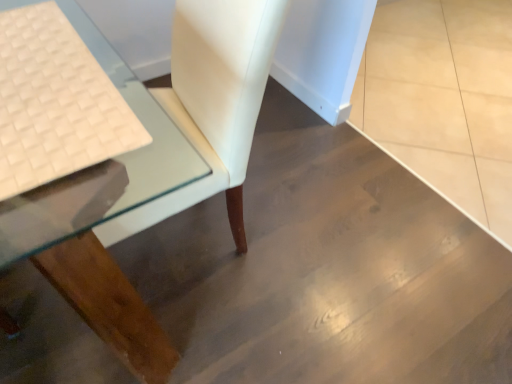
What is the approximate width of white woven fabric at left?

white woven fabric at left is 13.31 inches in width.

This screenshot has width=512, height=384. What do you see at coordinates (55, 102) in the screenshot? I see `white woven fabric at left` at bounding box center [55, 102].

Locate an element on the screen. white woven fabric at left is located at coordinates (55, 102).

Measure the distance between clear glass table at lower left and camera.

They are 21.34 inches apart.

The width and height of the screenshot is (512, 384). Describe the element at coordinates (102, 216) in the screenshot. I see `clear glass table at lower left` at that location.

Locate an element on the screen. The image size is (512, 384). clear glass table at lower left is located at coordinates (102, 216).

This screenshot has width=512, height=384. What are the coordinates of `white woven fabric at left` in the screenshot? It's located at (55, 102).

Is clear glass table at lower left to the right of white woven fabric at left from the viewer's perspective?

Yes, clear glass table at lower left is to the right of white woven fabric at left.

Is clear glass table at lower left behind white woven fabric at left?

That is False.

Looking at this image, which is closer, (152, 137) or (20, 14)?

Point (152, 137) is farther from the camera than point (20, 14).

From the image's perspective, which one is positioned lower, clear glass table at lower left or white woven fabric at left?

white woven fabric at left.

From a real-world perspective, is clear glass table at lower left beneath white woven fabric at left?

A: Indeed, from a real-world perspective, clear glass table at lower left is positioned beneath white woven fabric at left.

Does clear glass table at lower left have a greater width compared to white woven fabric at left?

Yes.

Considering the sizes of objects clear glass table at lower left and white woven fabric at left in the image provided, who is shorter, clear glass table at lower left or white woven fabric at left?

white woven fabric at left.

Does clear glass table at lower left have a smaller size compared to white woven fabric at left?

No, clear glass table at lower left is not smaller than white woven fabric at left.

Is clear glass table at lower left not inside white woven fabric at left?

Yes, clear glass table at lower left is outside of white woven fabric at left.

Can you see clear glass table at lower left touching white woven fabric at left?

No, clear glass table at lower left is not beside white woven fabric at left.

In the scene shown: Could you tell me if clear glass table at lower left is turned towards white woven fabric at left?

Yes.

Find the location of a particular element. table in front of the white woven fabric at left is located at coordinates (102, 216).

Which object is positioned more to the right, white woven fabric at left or clear glass table at lower left?

Positioned to the right is clear glass table at lower left.

Which object is further away from the camera, white woven fabric at left or clear glass table at lower left?

white woven fabric at left is more distant.

Does point (92, 77) come closer to viewer compared to point (72, 206)?

No, (92, 77) is further to viewer.

From the image's perspective, is white woven fabric at left located above clear glass table at lower left?

Incorrect, from the image's perspective, white woven fabric at left is lower than clear glass table at lower left.

From a real-world perspective, who is located lower, white woven fabric at left or clear glass table at lower left?

In real-world perspective, clear glass table at lower left is lower.

Is white woven fabric at left thinner than clear glass table at lower left?

Indeed, white woven fabric at left has a lesser width compared to clear glass table at lower left.

Does white woven fabric at left have a lesser height compared to clear glass table at lower left?

Yes.

Which of these two, white woven fabric at left or clear glass table at lower left, is bigger?

clear glass table at lower left is bigger.

Can we say white woven fabric at left lies outside clear glass table at lower left?

No, white woven fabric at left is inside or overlapping with clear glass table at lower left.

Is white woven fabric at left not close to clear glass table at lower left?

white woven fabric at left is actually quite close to clear glass table at lower left.

Is white woven fabric at left turned away from clear glass table at lower left?

Yes, white woven fabric at left is positioned with its back facing clear glass table at lower left.

How many degrees apart are the facing directions of white woven fabric at left and clear glass table at lower left?

They differ by 0.0897 degrees in their facing directions.

The image size is (512, 384). In order to click on table located in front of the white woven fabric at left in this screenshot , I will do `click(102, 216)`.

Where is `table that is in front of the white woven fabric at left`? This screenshot has width=512, height=384. table that is in front of the white woven fabric at left is located at coordinates (102, 216).

Find the location of a particular element. laptop keyboard behind the clear glass table at lower left is located at coordinates (55, 102).